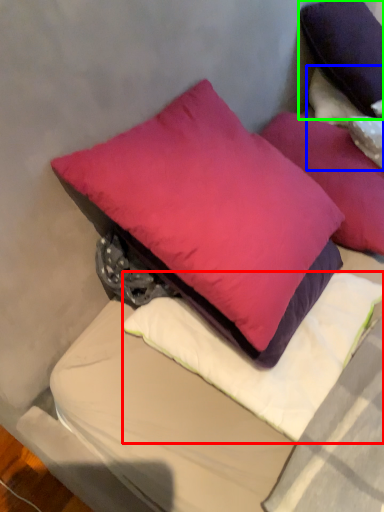
Question: Considering the real-world distances, which object is farthest from pillow (highlighted by a red box)? pillow (highlighted by a blue box) or pillow (highlighted by a green box)?

Choices:
 (A) pillow
 (B) pillow

Answer: (B)